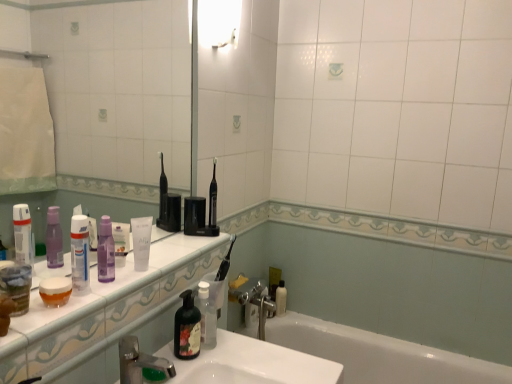
Locate an element on the screen. This screenshot has width=512, height=384. free area in between white matte tube at center, positioned as the 4th toiletry in right-to-left order, and translucent plastic jar at lower left, which appears as the second mouthwash when viewed from the back is located at coordinates (109, 286).